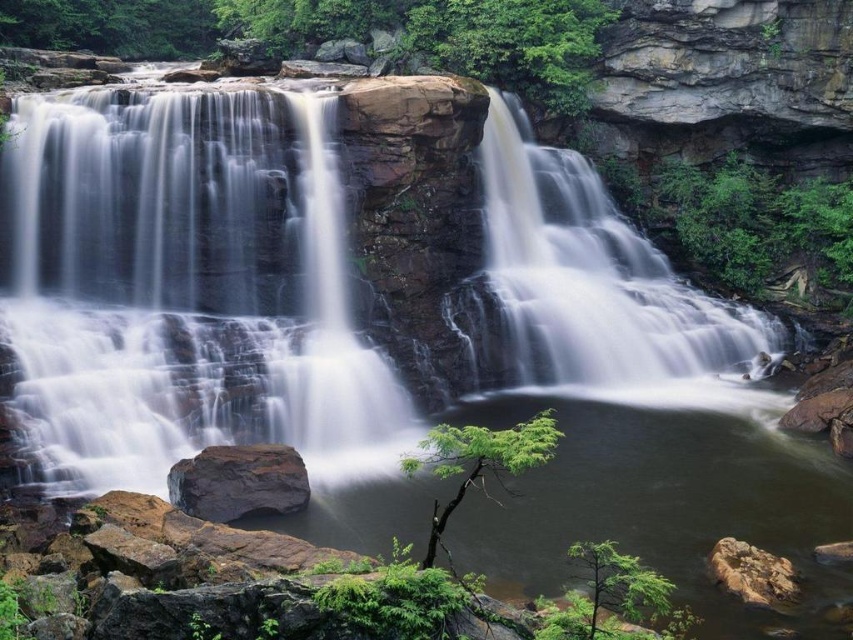
Between white smooth waterfall at upper right and smooth dark rock at center, which one appears on the left side from the viewer's perspective?

smooth dark rock at center is more to the left.

Locate an element on the screen. white smooth waterfall at upper right is located at coordinates (596, 278).

Does smooth dark rock at center have a larger size compared to rough textured rock at lower right?

Correct, smooth dark rock at center is larger in size than rough textured rock at lower right.

Who is taller, smooth dark rock at center or rough textured rock at lower right?

smooth dark rock at center

Between point (224, 481) and point (732, 588), which one is positioned behind?

Positioned behind is point (224, 481).

Where is `smooth dark rock at center`? smooth dark rock at center is located at coordinates (238, 481).

Is point (384, 438) less distant than point (254, 445)?

That is False.

Who is more distant from viewer, (392, 381) or (276, 464)?

The point (392, 381) is behind.

The image size is (853, 640). Identify the location of white smooth waterfall at left. (184, 289).